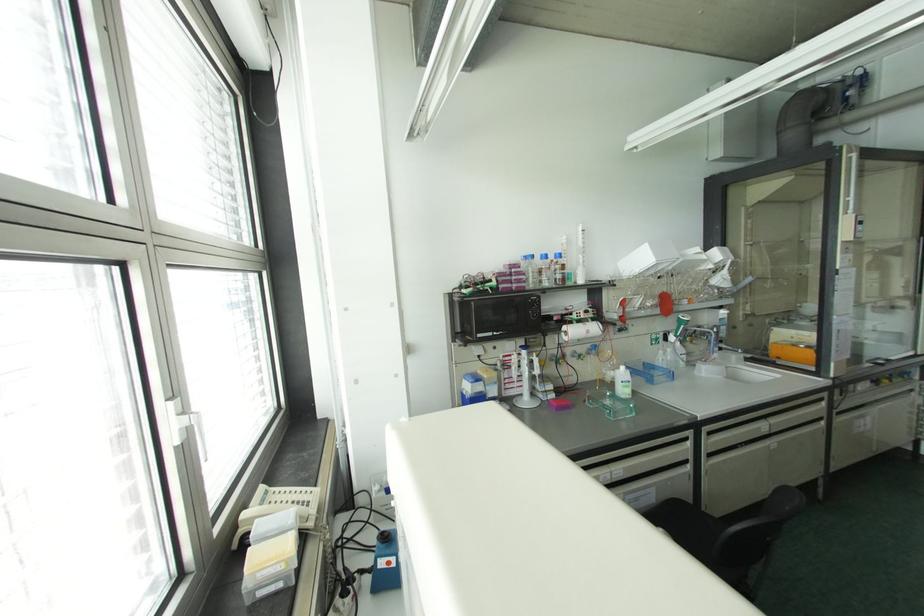
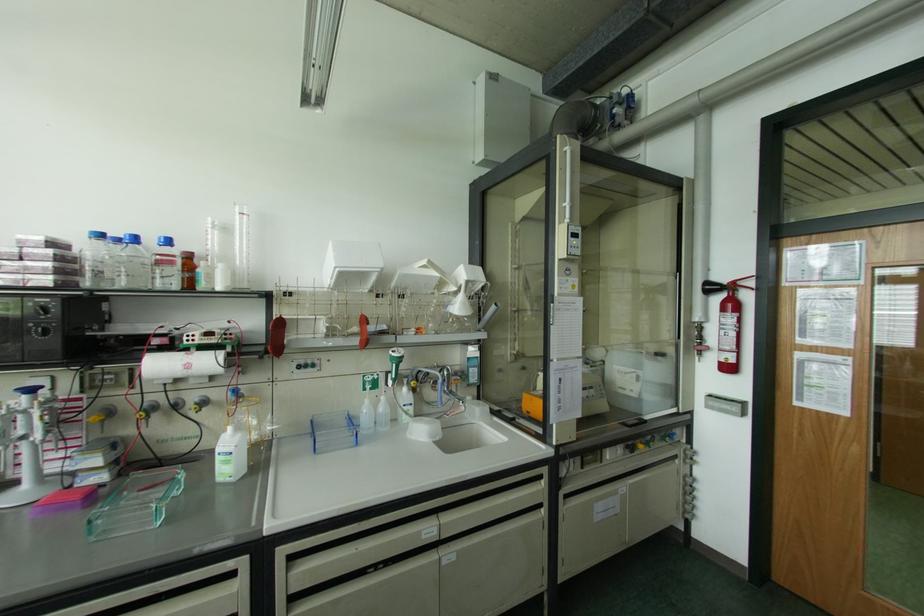
The point at (588, 331) is marked in the first image. Where is the corresponding point in the second image?

(188, 366)